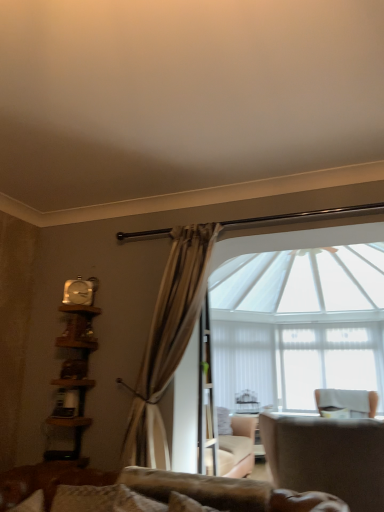
Question: Does point (92, 289) appear closer or farther from the camera than point (316, 426)?

Choices:
 (A) farther
 (B) closer

Answer: (A)

Question: From a real-world perspective, relative to leather-like beige armchair at lower right, arranged as the first chair when viewed from the left, is metallic silver clock at upper left vertically above or below?

Choices:
 (A) above
 (B) below

Answer: (A)

Question: Which object is the closest to the metallic silver clock at upper left?

Choices:
 (A) wooden bookshelf at left
 (B) leather-like beige armchair at lower right, marked as the 2th chair in a right-to-left arrangement
 (C) white fabric chair at right, positioned as the first chair in back-to-front order
 (D) white sheer fabric at center

Answer: (A)

Question: Which object is positioned closest to the white fabric chair at right, which appears as the first chair when ordered from the bottom?

Choices:
 (A) wooden bookshelf at left
 (B) metallic silver clock at upper left
 (C) leather-like beige armchair at lower right, which is the first chair from front to back
 (D) white sheer fabric at center

Answer: (D)